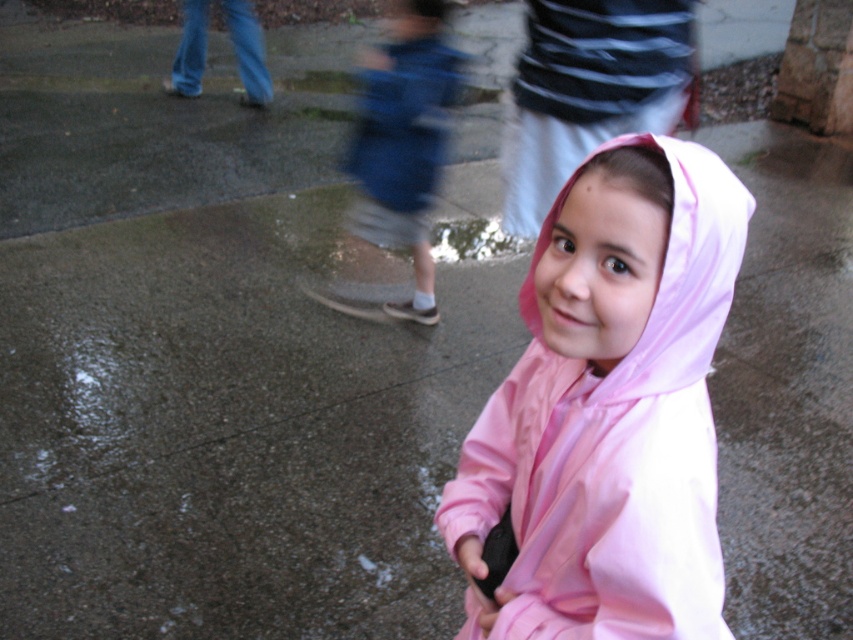
You are a parent trying to decide which item to grab first from the muddy pavement. The pink matte raincoat at center and the blue denim shorts at center are both lying there. Which item is shorter in height and thus easier to spot quickly?

The pink matte raincoat at center is not as tall as blue denim shorts at center, so it is shorter and easier to spot quickly.